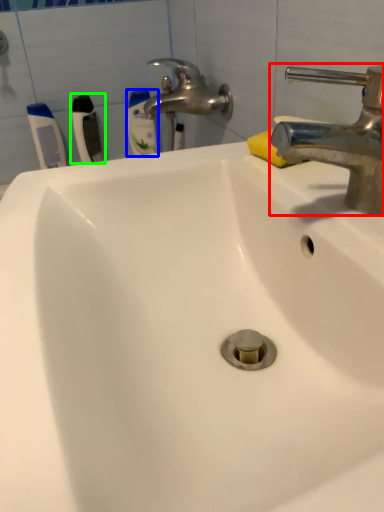
Question: Based on their relative distances, which object is nearer to tap (highlighted by a red box)? Choose from toothbrush (highlighted by a blue box) and toothbrush (highlighted by a green box).

Choices:
 (A) toothbrush
 (B) toothbrush

Answer: (B)